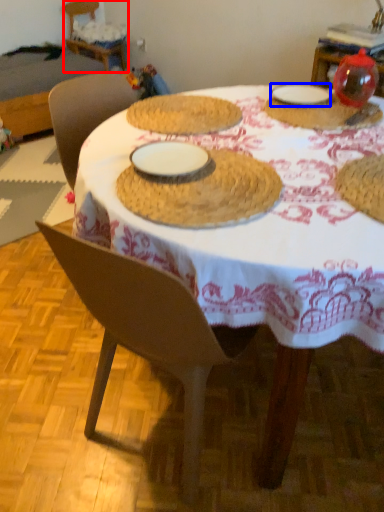
Question: Which object is closer to the camera taking this photo, chair (highlighted by a red box) or tableware (highlighted by a blue box)?

Choices:
 (A) chair
 (B) tableware

Answer: (B)